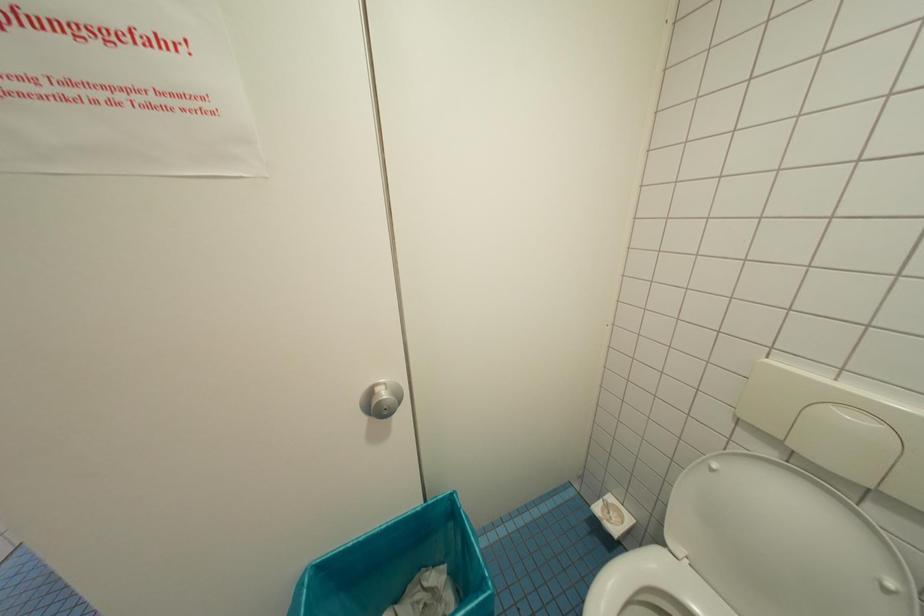
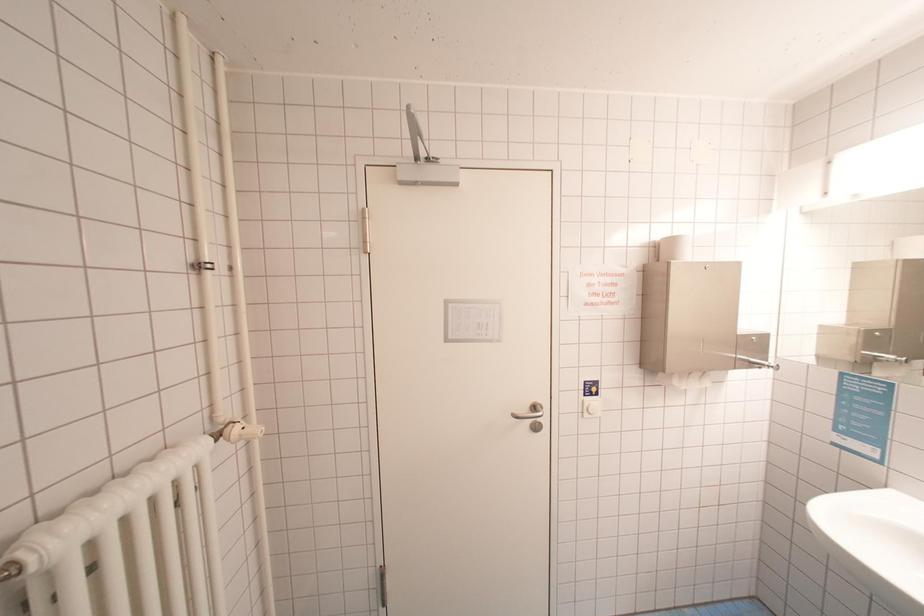
Question: The images are taken continuously from a first-person perspective. In which direction is your viewpoint rotating?

Choices:
 (A) Left
 (B) Right
 (C) Up
 (D) Down

Answer: (A)